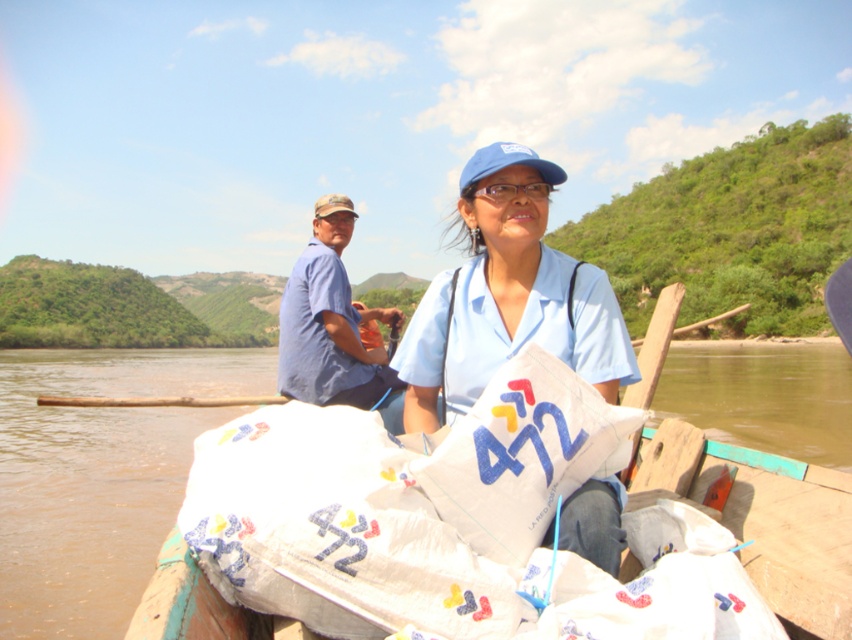
Question: Can you confirm if blue fabric shirt at center is positioned to the right of blue cotton shirt at center?

Choices:
 (A) no
 (B) yes

Answer: (B)

Question: In this image, where is blue fabric shirt at center located relative to white fabric bags at center?

Choices:
 (A) right
 (B) left

Answer: (B)

Question: Can you confirm if blue fabric shirt at center is positioned to the left of blue cotton shirt at center?

Choices:
 (A) yes
 (B) no

Answer: (B)

Question: Which of the following is the closest to the observer?

Choices:
 (A) blue cotton shirt at center
 (B) white fabric bags at center
 (C) blue fabric shirt at center

Answer: (B)

Question: Among these points, which one is farthest from the camera?

Choices:
 (A) (824, 504)
 (B) (413, 337)

Answer: (B)

Question: Which object is positioned farthest from the blue cotton shirt at center?

Choices:
 (A) white fabric bags at center
 (B) blue fabric shirt at center

Answer: (A)